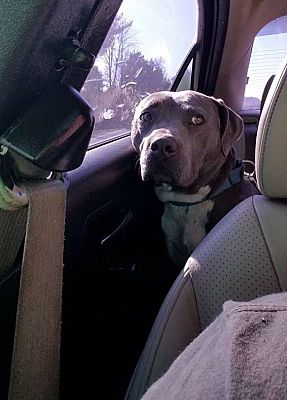
At what (x,y) coordinates should I click in order to perform the action: click on window. Please return your answer as a coordinate pair (x, y). The height and width of the screenshot is (400, 287). Looking at the image, I should click on (117, 62).